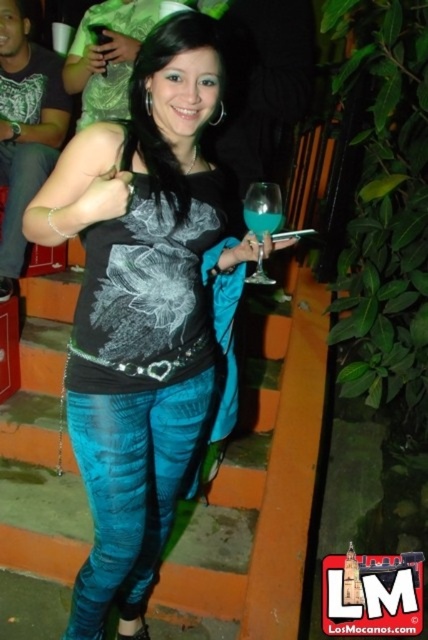
You are at a party and see the woman in the matte black shirt at center holding something in her hand. Is the translucent glass at center in front of or behind her shirt?

The translucent glass at center is behind the matte black shirt at center, so it is behind her shirt.

You are a photographer adjusting your camera settings to focus on the matte black tank top at center. What are the coordinates where you should aim your focus point?

The matte black tank top at center is located at point (139,308), so you should aim your focus point there.

You are at a party and want to hand your friend a drink. You have a translucent blue glass at center in your hand. Your friend is standing 4.21 feet away from you. Can you reach them to hand them the drink without moving closer?

The distance between you and your friend is 4.21 feet. Since the average human arm length is about 2.5 feet, you cannot reach them without moving closer.